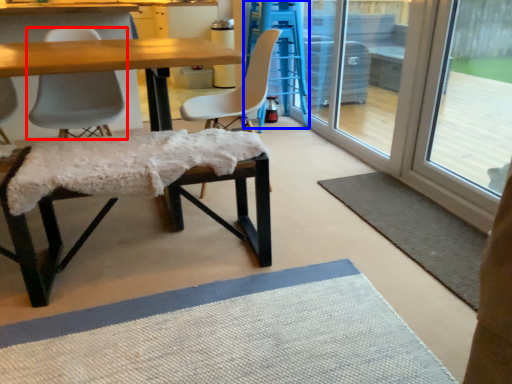
Question: Which of the following is the closest to the observer, chair (highlighted by a red box) or bar stool (highlighted by a blue box)?

Choices:
 (A) chair
 (B) bar stool

Answer: (A)